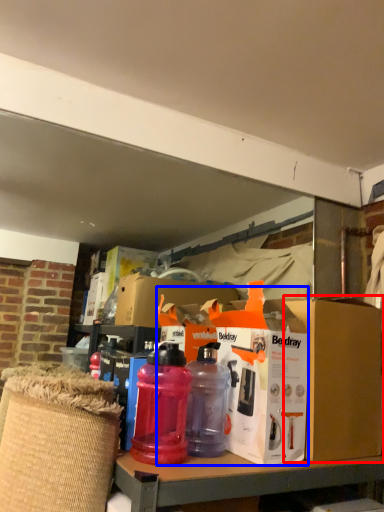
Question: Among these objects, which one is farthest to the camera, cardboard box (highlighted by a red box) or box (highlighted by a blue box)?

Choices:
 (A) cardboard box
 (B) box

Answer: (A)